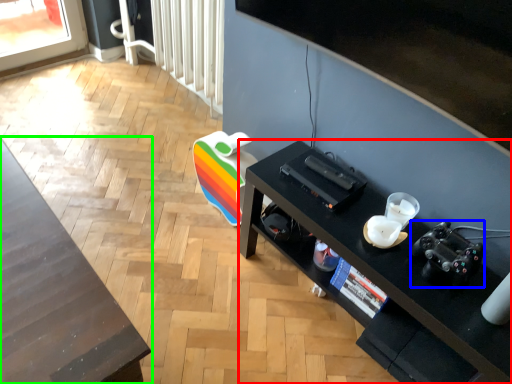
Question: Which is nearer to the desk (highlighted by a red box)? video camera (highlighted by a blue box) or table (highlighted by a green box).

Choices:
 (A) video camera
 (B) table

Answer: (A)